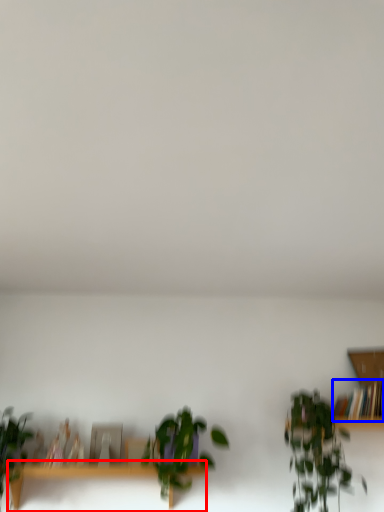
Question: Which object is closer to the camera taking this photo, table (highlighted by a red box) or book (highlighted by a blue box)?

Choices:
 (A) table
 (B) book

Answer: (A)